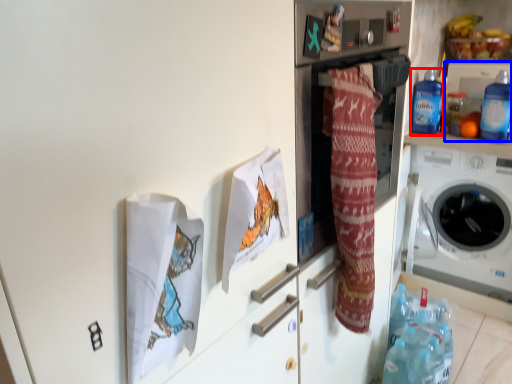
Question: Which object is closer to the camera taking this photo, bottle (highlighted by a red box) or appliance (highlighted by a blue box)?

Choices:
 (A) bottle
 (B) appliance

Answer: (A)